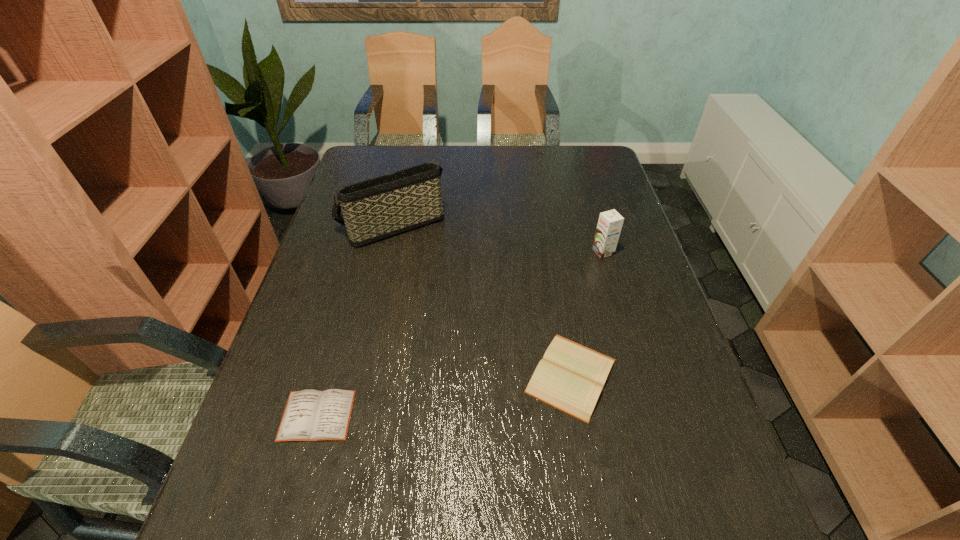
Point out which object is positioned as the second nearest to the rightmost object. Please provide its 2D coordinates. Your answer should be formatted as a tuple, i.e. [(x, y)], where the tuple contains the x and y coordinates of a point satisfying the conditions above.

[(374, 209)]

Locate an element on the screen. object that ranks as the closest to the shorter diary is located at coordinates (571, 377).

Where is `free space that satisfies the following two spatial constraints: 1. on the back side of the shortest object; 2. on the left side of the chocolate milk`? free space that satisfies the following two spatial constraints: 1. on the back side of the shortest object; 2. on the left side of the chocolate milk is located at coordinates (363, 252).

This screenshot has height=540, width=960. What are the coordinates of `vacant space that satisfies the following two spatial constraints: 1. on the back side of the left diary; 2. on the left side of the second object from right to left` in the screenshot? It's located at (328, 376).